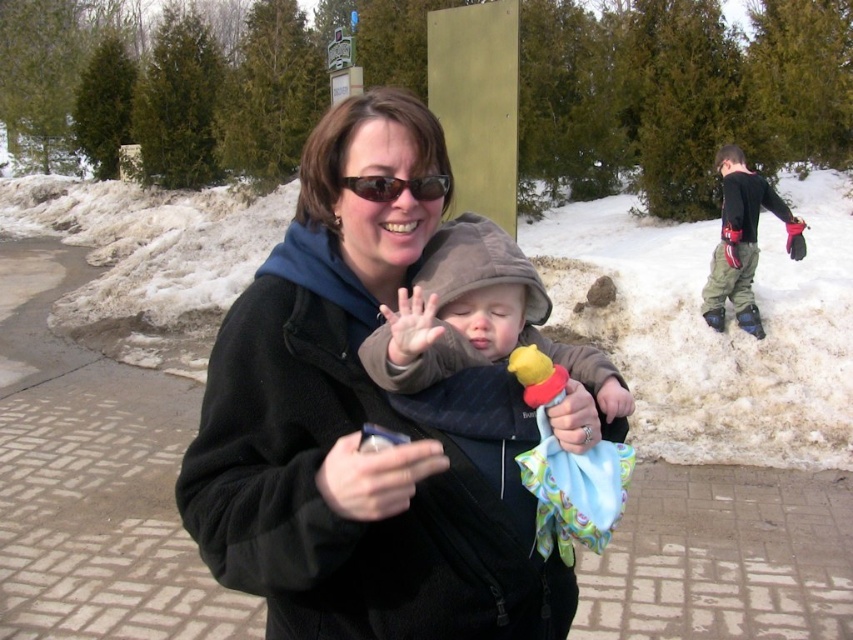
You are a photographer trying to capture a candid shot of the woman and baby in the winter scene. You need to ensure that both the brown fleece jacket at center and the dark green pants at right are in focus. Given that your camera can only focus on objects within a 15 feet range, will you be able to capture both subjects clearly?

The distance between the brown fleece jacket at center and the dark green pants at right is 16.43 feet, which exceeds the camera focus range of 15 feet. Therefore, you cannot capture both subjects clearly in focus.

You are a photographer trying to capture a closeup of the black fleece jacket at center and the black matte hand at center. Which object should you zoom in on to ensure both are in focus without moving the camera?

The black fleece jacket at center is wider than the black matte hand at center, so you should zoom in on the black fleece jacket at center to ensure both are in focus.

In the scene shown: You are standing in the winter scene and want to take a photo of the dark green pants at right. Where should you position your camera to capture them in the frame?

Position your camera at the 2D coordinates point (741, 237) to capture the dark green pants at right in the frame.